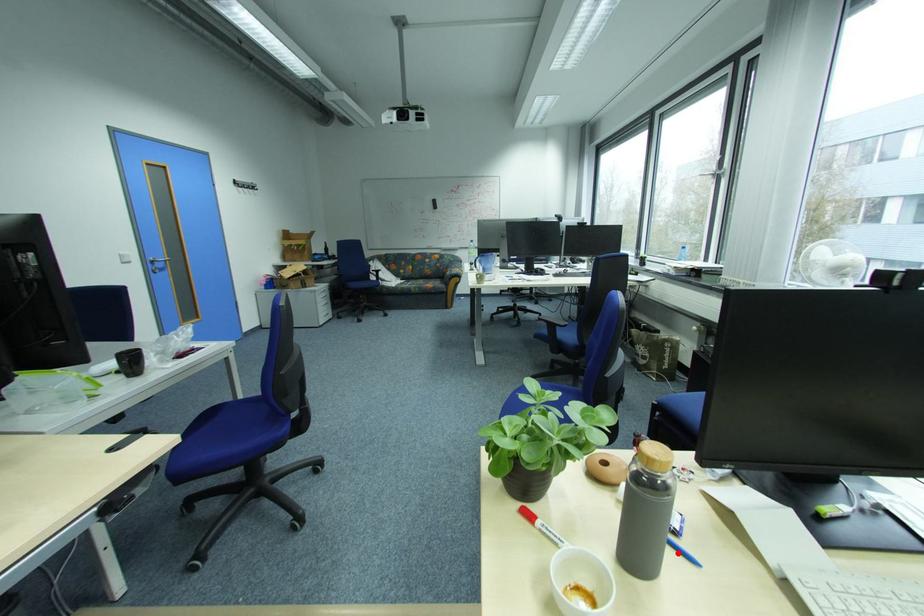
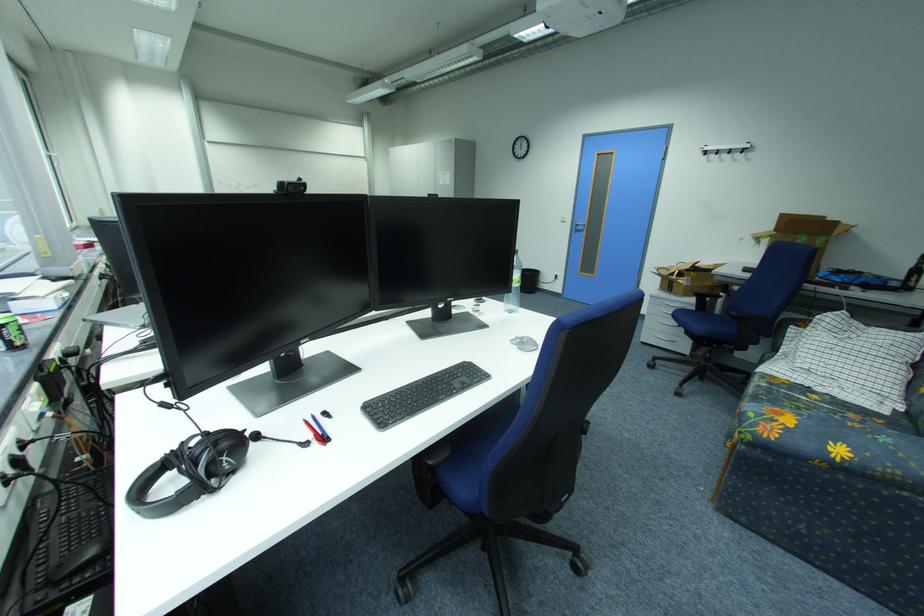
Question: I am providing you with two images of the same scene from different viewpoints. A red point is marked on the first image. Is the red point's position out of view in image 2?

Choices:
 (A) Yes
 (B) No

Answer: (A)